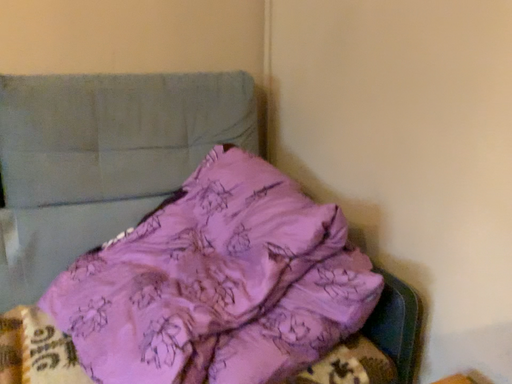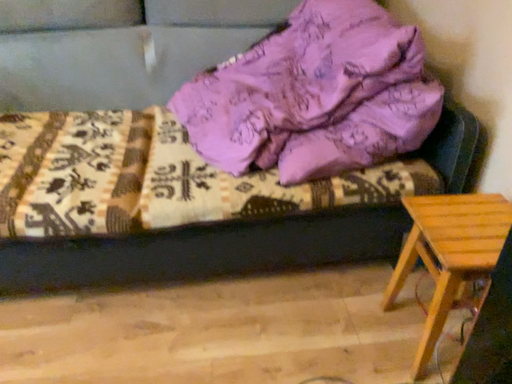
Question: How did the camera likely rotate when shooting the video?

Choices:
 (A) rotated right
 (B) rotated left

Answer: (B)